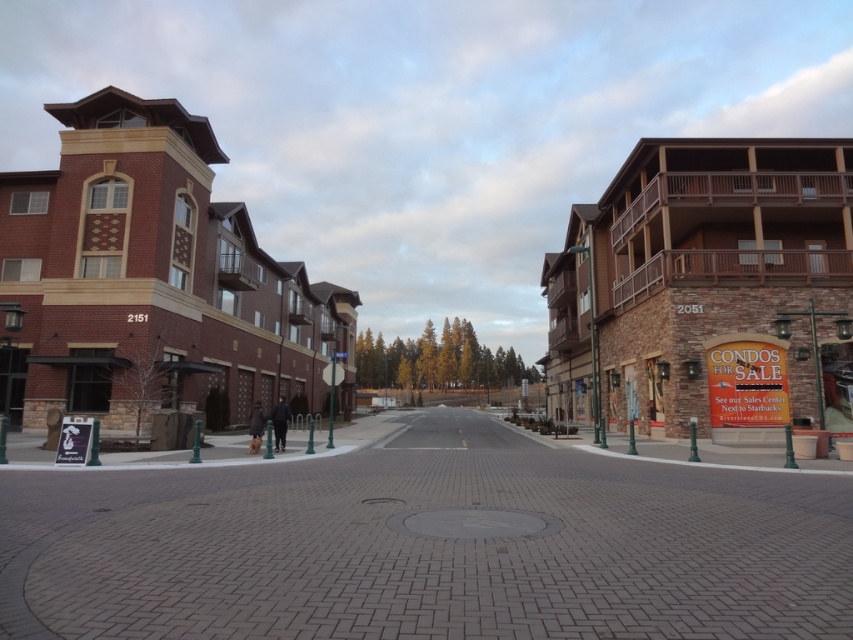
What do you see at coordinates (167, 284) in the screenshot? The image size is (853, 640). I see `brick building at center` at bounding box center [167, 284].

Can you confirm if brick building at center is positioned above brown stone building at right?

Indeed, brick building at center is positioned over brown stone building at right.

This screenshot has height=640, width=853. I want to click on brick building at center, so click(167, 284).

At what (x,y) coordinates should I click in order to perform the action: click on brick building at center. Please return your answer as a coordinate pair (x, y). The height and width of the screenshot is (640, 853). Looking at the image, I should click on (167, 284).

Between brick building at center and brick building at left, which one appears on the right side from the viewer's perspective?

Positioned to the right is brick building at center.

Does brick building at center have a lesser width compared to brick building at left?

In fact, brick building at center might be wider than brick building at left.

Between point (766, 435) and point (119, 289), which one is positioned in front?

Point (766, 435) is more forward.

At what (x,y) coordinates should I click in order to perform the action: click on brick building at center. Please return your answer as a coordinate pair (x, y). The height and width of the screenshot is (640, 853). Looking at the image, I should click on (167, 284).

Between brick building at left and brown stone building at right, which one appears on the left side from the viewer's perspective?

Positioned to the left is brick building at left.

Is the position of brick building at left less distant than that of brown stone building at right?

No, it is behind brown stone building at right.

Which is behind, point (175, 292) or point (671, 140)?

Point (175, 292)

You are a GUI agent. You are given a task and a screenshot of the screen. Output one action in this format:
    pyautogui.click(x=<x>, y=<y>)
    Task: Click on the brick building at left
    
    Given the screenshot: What is the action you would take?
    pyautogui.click(x=151, y=280)